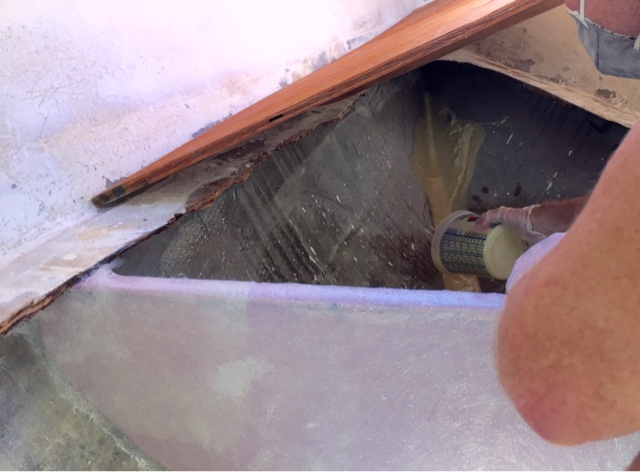
Where is `mess that needs to be cleaned up`? The height and width of the screenshot is (472, 640). mess that needs to be cleaned up is located at coordinates (445, 186).